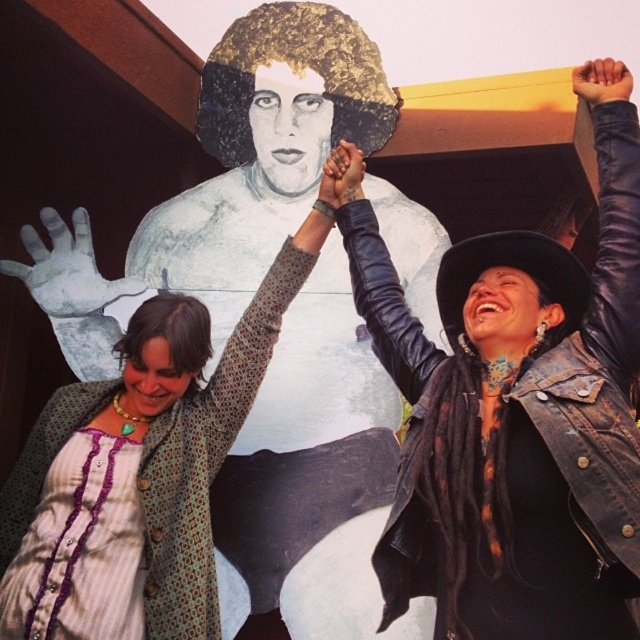
You are standing at the center of the scene and see the patterned fabric dress at upper left and the tattooed skin at center. Which object is closer to you?

The tattooed skin at center is closer to you because it is at the center of the scene, while the patterned fabric dress at upper left is 13.46 meters away from it.

You are a photographer standing in front of the mural. You want to take a photo that includes both the patterned fabric dress at upper left and the smooth leather hand at upper right. Based on their positions, which object should you focus on first to ensure both are in frame?

The patterned fabric dress at upper left is to the left of the smooth leather hand at upper right. To include both in the frame, focus on the patterned fabric dress at upper left first as it is positioned further left, allowing the hand to be captured on the right side of the image.